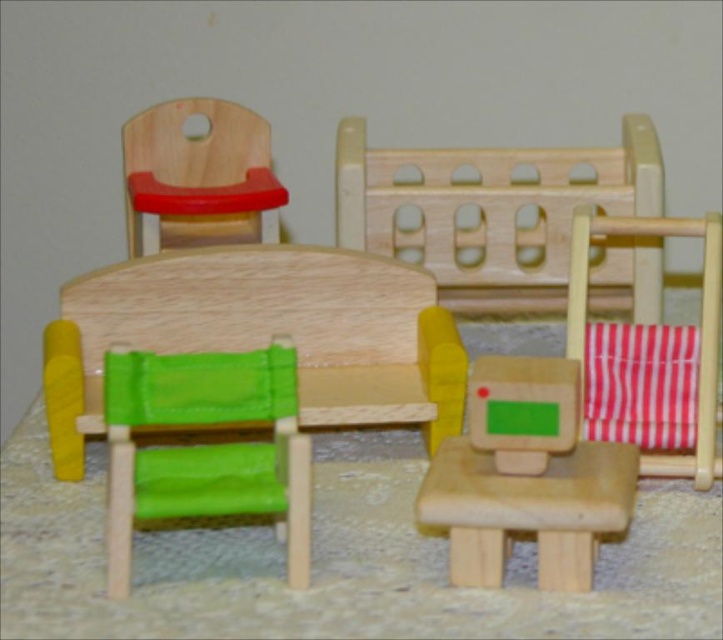
You are a parent placing a toy on the green fabric table at center and the green fabric chair at center. Which surface is closer to you?

The green fabric table at center is closer to you than the green fabric chair at center.

You are setting up a playroom and need to arrange the matte wooden chair at center and the green fabric chair at center. Which chair is shorter?

The matte wooden chair at center is shorter than the green fabric chair at center.